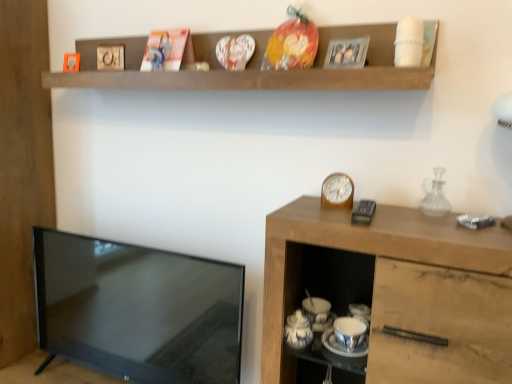
Question: Is metallic silver photo frame at upper center, which is counted as the 1th picture frame, starting from the front, positioned with its back to metallic gold picture frame at upper center, placed as the 2th picture frame when sorted from back to front?

Choices:
 (A) no
 (B) yes

Answer: (A)

Question: Can you see metallic silver photo frame at upper center, positioned as the fourth picture frame in back-to-front order, touching metallic gold picture frame at upper center, which appears as the third picture frame when viewed from the front?

Choices:
 (A) no
 (B) yes

Answer: (A)

Question: Is metallic silver photo frame at upper center, which appears as the fourth picture frame when viewed from the left, shorter than metallic gold picture frame at upper center, placed as the 2th picture frame when sorted from back to front?

Choices:
 (A) no
 (B) yes

Answer: (A)

Question: Considering the relative positions of metallic silver photo frame at upper center, positioned as the fourth picture frame in back-to-front order, and metallic gold picture frame at upper center, which is the 2th picture frame in left-to-right order, in the image provided, is metallic silver photo frame at upper center, positioned as the fourth picture frame in back-to-front order, in front of metallic gold picture frame at upper center, which is the 2th picture frame in left-to-right order,?

Choices:
 (A) yes
 (B) no

Answer: (A)

Question: Is metallic silver photo frame at upper center, which is counted as the 1th picture frame, starting from the front, not within metallic gold picture frame at upper center, placed as the 2th picture frame when sorted from back to front?

Choices:
 (A) yes
 (B) no

Answer: (A)

Question: Considering the positions of point (332, 349) and point (354, 56), is point (332, 349) closer or farther from the camera than point (354, 56)?

Choices:
 (A) farther
 (B) closer

Answer: (A)

Question: Looking at the image, does white glossy saucer at lower center seem bigger or smaller compared to metallic silver photo frame at upper center, which appears as the fourth picture frame when viewed from the left?

Choices:
 (A) big
 (B) small

Answer: (B)

Question: From the image's perspective, relative to metallic silver photo frame at upper center, which is counted as the 1th picture frame, starting from the front, is white glossy saucer at lower center above or below?

Choices:
 (A) above
 (B) below

Answer: (B)

Question: From a real-world perspective, is white glossy saucer at lower center above or below metallic silver photo frame at upper center, positioned as the fourth picture frame in back-to-front order?

Choices:
 (A) below
 (B) above

Answer: (A)

Question: Is brown wooden shelf at upper center wider or thinner than matte black tv at left?

Choices:
 (A) thin
 (B) wide

Answer: (B)

Question: Based on their positions, is brown wooden shelf at upper center located to the left or right of matte black tv at left?

Choices:
 (A) right
 (B) left

Answer: (A)

Question: Considering their positions, is brown wooden shelf at upper center located in front of or behind matte black tv at left?

Choices:
 (A) behind
 (B) front

Answer: (B)

Question: From the image's perspective, is brown wooden shelf at upper center located above or below matte black tv at left?

Choices:
 (A) above
 (B) below

Answer: (A)

Question: From a real-world perspective, is metallic silver photo frame at upper center, positioned as the fourth picture frame in back-to-front order, positioned above or below metallic gold picture frame at upper center, which is the 2th picture frame in left-to-right order?

Choices:
 (A) above
 (B) below

Answer: (B)

Question: Considering their positions, is metallic silver photo frame at upper center, which is counted as the 1th picture frame, starting from the front, located in front of or behind metallic gold picture frame at upper center, which appears as the third picture frame when viewed from the front?

Choices:
 (A) behind
 (B) front

Answer: (B)